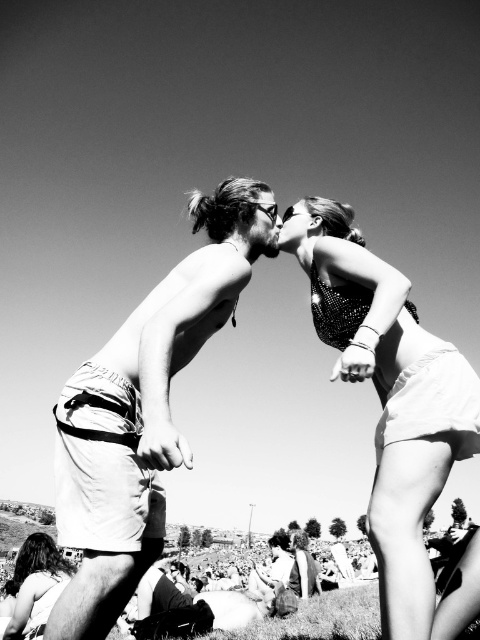
Question: Does light beige shorts at center have a smaller size compared to dark hair at lower left?

Choices:
 (A) yes
 (B) no

Answer: (A)

Question: Which of the following is the closest to the observer?

Choices:
 (A) (331, 304)
 (B) (298, 561)
 (C) (196, 312)

Answer: (C)

Question: Is sparkly sequin top at upper right closer to camera compared to shiny sequined dress at center?

Choices:
 (A) yes
 (B) no

Answer: (A)

Question: Which of the following is the farthest from the observer?

Choices:
 (A) sparkly sequin top at upper right
 (B) light beige shorts at center
 (C) dark hair at lower left
 (D) shiny sequined dress at center

Answer: (D)

Question: Is light beige shorts at center to the left of sparkly sequin top at upper right from the viewer's perspective?

Choices:
 (A) no
 (B) yes

Answer: (B)

Question: Which object is farther from the camera taking this photo?

Choices:
 (A) shiny sequined dress at center
 (B) dark hair at lower left
 (C) light beige shorts at center
 (D) sparkly sequin top at upper right

Answer: (A)